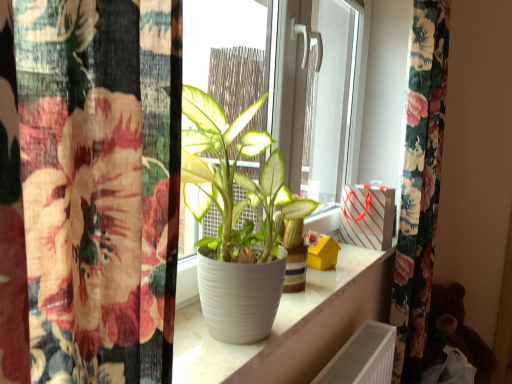
Find the location of a particular element. This screenshot has width=512, height=384. free point below white matte pot at center (from a real-world perspective) is located at coordinates (211, 344).